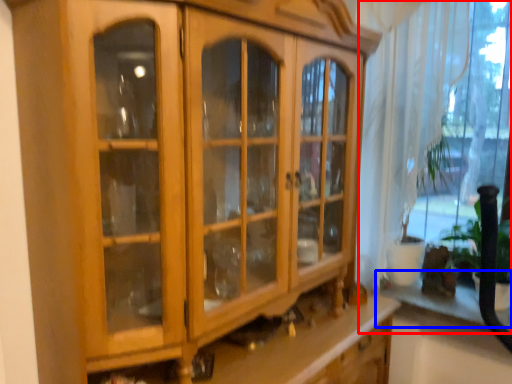
Question: Which object appears closest to the camera in this image, window (highlighted by a red box) or shelf (highlighted by a blue box)?

Choices:
 (A) window
 (B) shelf

Answer: (A)